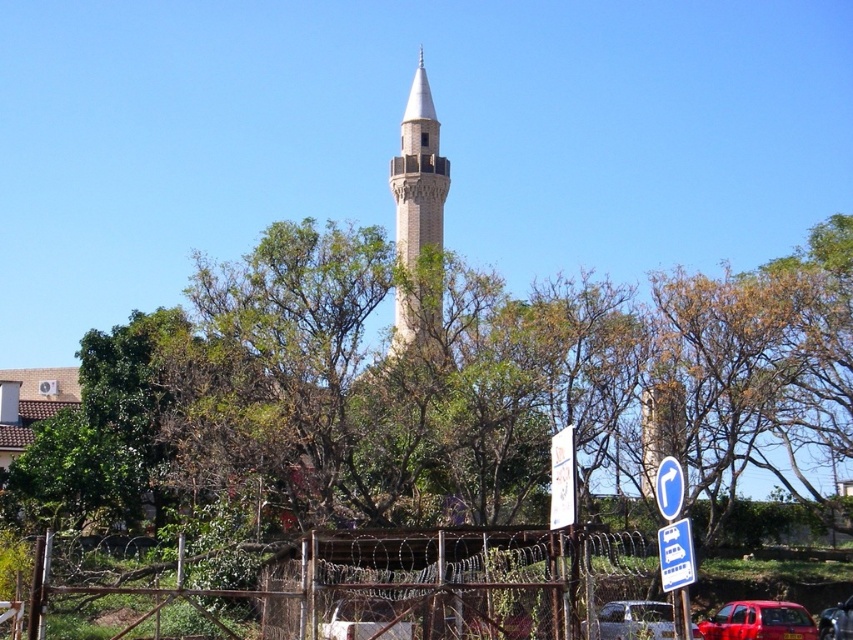
You are a pedestrian standing near the signpost and want to cross the road to reach the minaret. There are two cars in your path. Which car, the shiny red car at lower right or the metallic silver car at center, is closer to you?

The shiny red car at lower right is closer to you because it is positioned under the metallic silver car at center, indicating it is in front and nearer to your position near the signpost.

You are standing at the base of the minaret and want to take a photo of the shiny red car at lower right. Based on its position, which direction should you face to capture the car in your shot?

The shiny red car at lower right is located at point coordinates, so you should face towards the lower right direction to capture it in your shot.